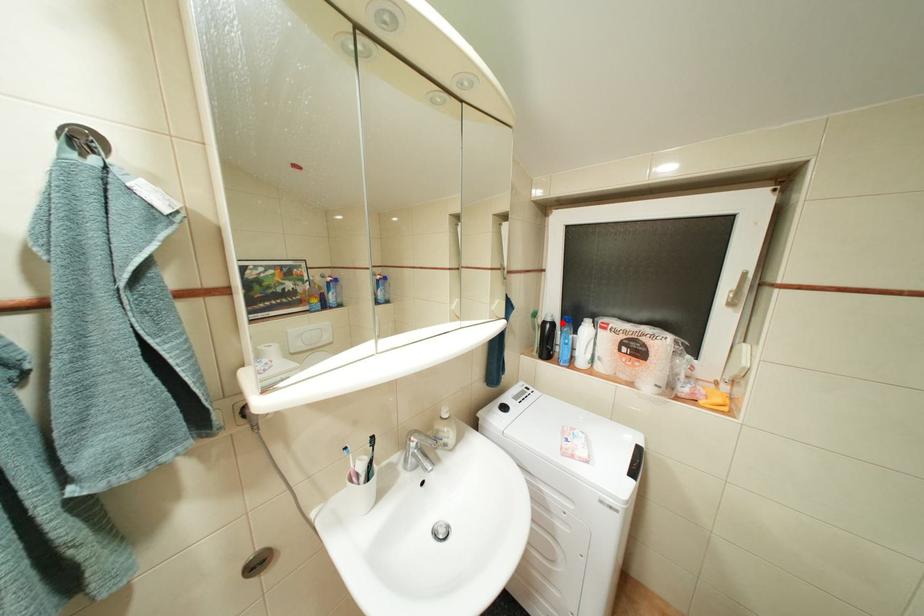
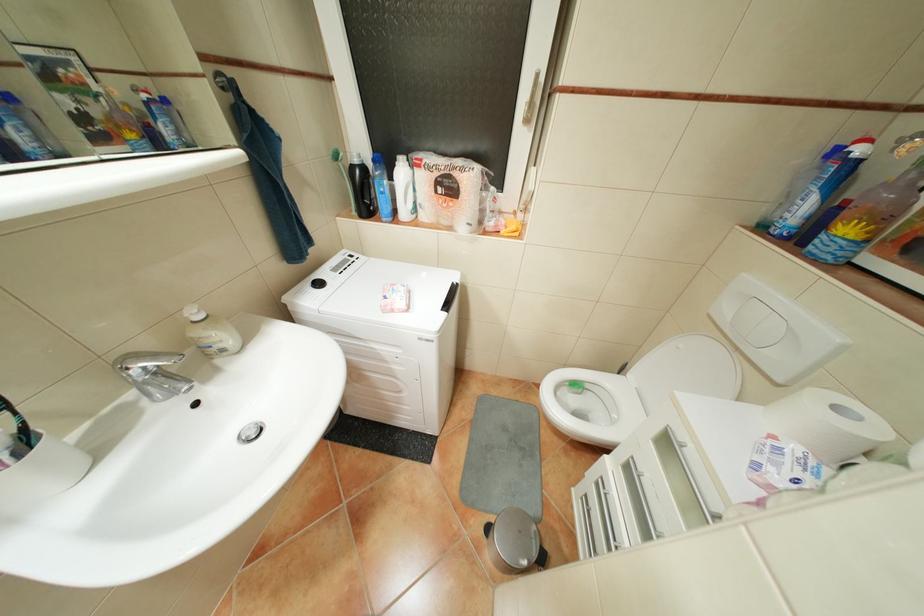
Find the pixel in the second image that matches the highlighted location in the first image.

(373, 167)